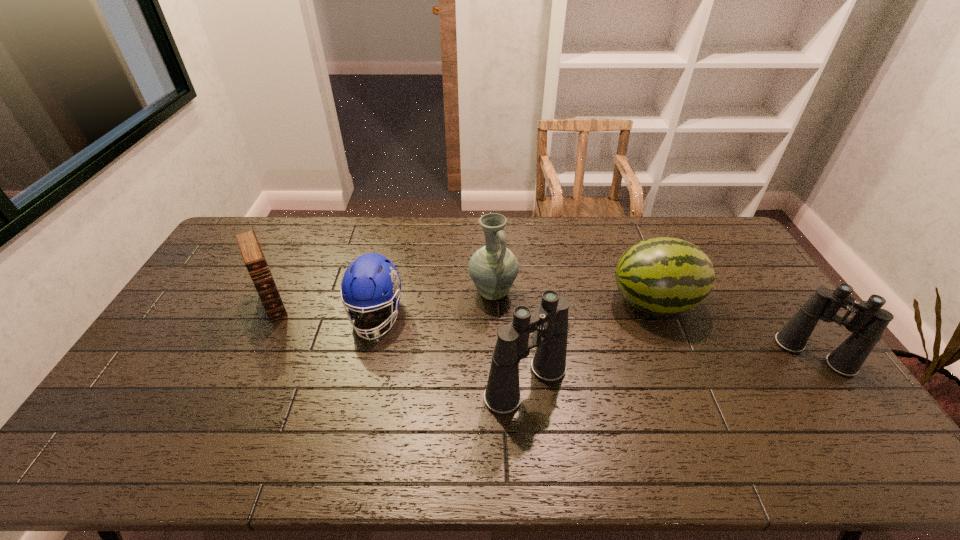
Locate an element on the screen. The height and width of the screenshot is (540, 960). vacant space located at the stem end of the watermelon is located at coordinates (495, 302).

I want to click on vacant space positioned at the stem end of the watermelon, so click(x=591, y=302).

Locate an element on the screen. Image resolution: width=960 pixels, height=540 pixels. vacant space situated on the face guard of the second object from left to right is located at coordinates (353, 413).

Image resolution: width=960 pixels, height=540 pixels. What are the coordinates of `vacant space located on the handle side of the pitcher` in the screenshot? It's located at (493, 321).

You are a GUI agent. You are given a task and a screenshot of the screen. Output one action in this format:
    pyautogui.click(x=<x>, y=<y>)
    Task: Click on the vacant space located 0.150m on the left of the leftmost object
    Image resolution: width=960 pixels, height=540 pixels.
    Given the screenshot: What is the action you would take?
    pyautogui.click(x=206, y=303)

I want to click on object located at the near edge, so click(x=549, y=323).

You are a GUI agent. You are given a task and a screenshot of the screen. Output one action in this format:
    pyautogui.click(x=<x>, y=<y>)
    Task: Click on the object present at the right edge
    Image resolution: width=960 pixels, height=540 pixels.
    Given the screenshot: What is the action you would take?
    pyautogui.click(x=868, y=324)

You are a GUI agent. You are given a task and a screenshot of the screen. Output one action in this format:
    pyautogui.click(x=<x>, y=<y>)
    Task: Click on the free space at the far edge of the desktop
    
    Given the screenshot: What is the action you would take?
    pyautogui.click(x=334, y=219)

Identify the location of vacant area at the near edge of the desktop. (365, 394).

This screenshot has width=960, height=540. What are the coordinates of `free region at the left edge of the desktop` in the screenshot? It's located at (150, 391).